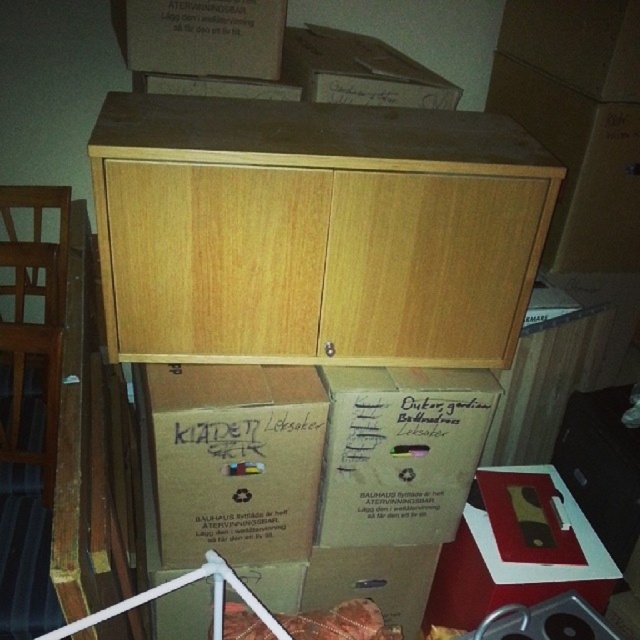
Question: Where is wooden box at upper center located in relation to brown cardboard box at lower right in the image?

Choices:
 (A) above
 (B) below

Answer: (A)

Question: Which of the following is the farthest from the observer?

Choices:
 (A) (410, 200)
 (B) (451, 586)
 (C) (296, 52)

Answer: (B)

Question: Is brown cardboard box at lower center thinner than wooden box at upper center?

Choices:
 (A) no
 (B) yes

Answer: (B)

Question: Among these objects, which one is farthest from the camera?

Choices:
 (A) brown cardboard box at center
 (B) matte cardboard box at lower right
 (C) brown cardboard box at lower right
 (D) brown cardboard box at lower center

Answer: (C)

Question: Which point is closer to the camera?

Choices:
 (A) matte cardboard box at lower right
 (B) wooden box at upper center
 (C) brown cardboard box at lower center

Answer: (C)

Question: In this image, where is light wood cabinet at upper center located relative to brown cardboard box at center?

Choices:
 (A) below
 (B) above

Answer: (B)